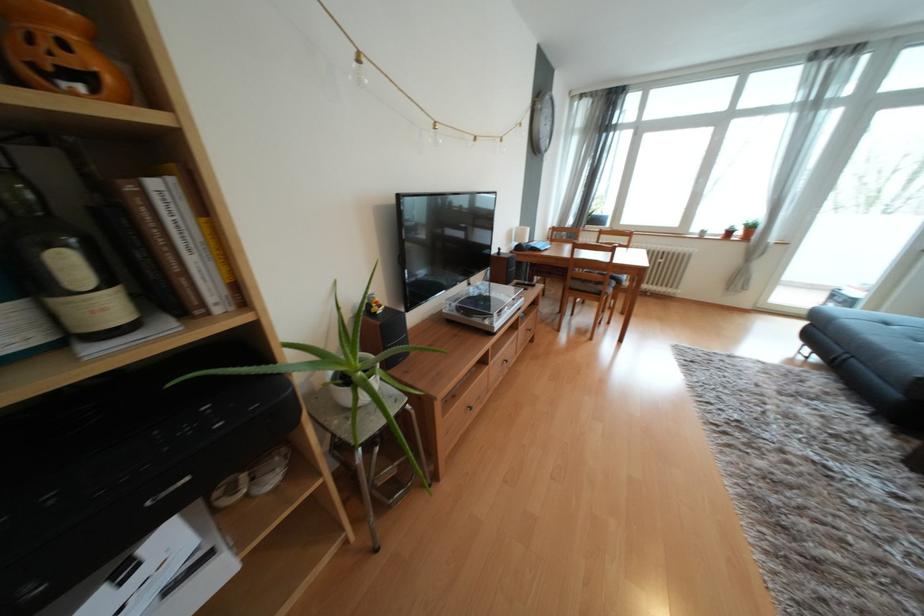
Describe the element at coordinates (881, 347) in the screenshot. I see `the sofa sitting surface` at that location.